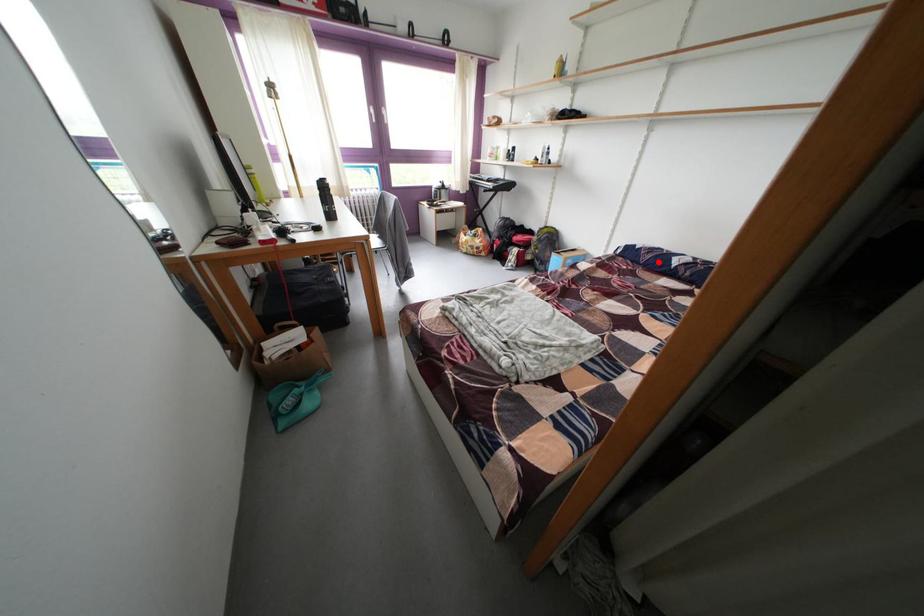
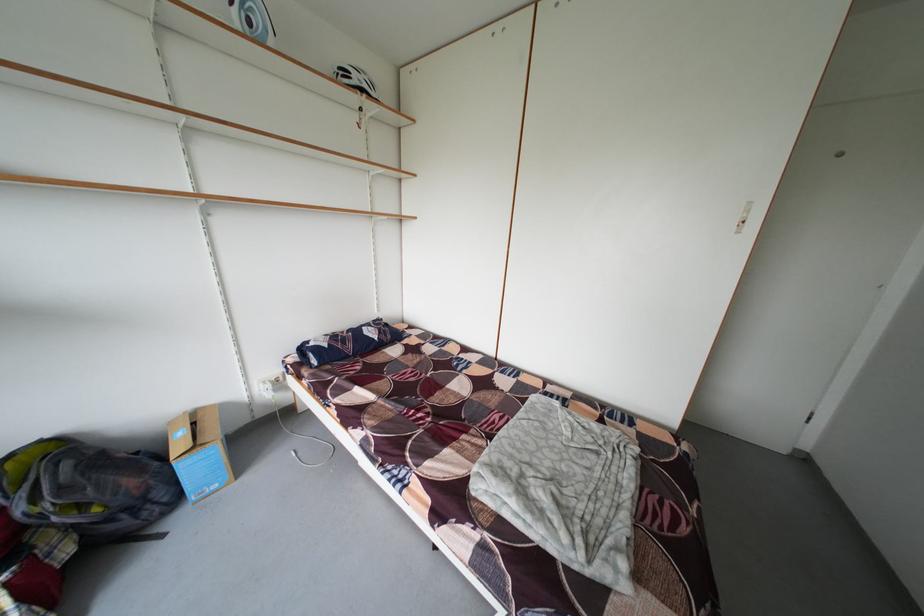
Find the pixel in the second image that matches the highlighted location in the first image.

(360, 351)